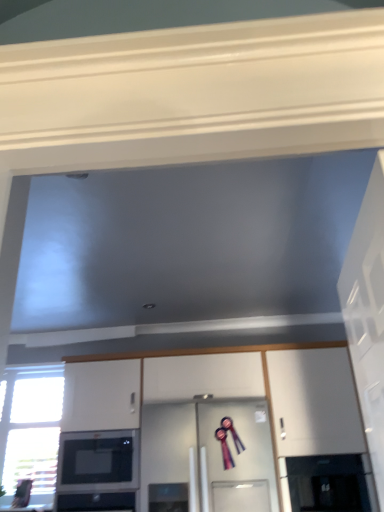
Image resolution: width=384 pixels, height=512 pixels. Describe the element at coordinates (267, 394) in the screenshot. I see `white glossy cabinet at center` at that location.

The height and width of the screenshot is (512, 384). Describe the element at coordinates (99, 459) in the screenshot. I see `black glossy microwave at lower left` at that location.

I want to click on clear glass door at center, arranged as the first glass door when viewed from the left, so click(242, 440).

Is black glossy microwave at lower left taller than transparent glass door at lower right, marked as the first glass door in a right-to-left arrangement?

Indeed, black glossy microwave at lower left has a greater height compared to transparent glass door at lower right, marked as the first glass door in a right-to-left arrangement.

Relative to transparent glass door at lower right, marked as the first glass door in a right-to-left arrangement, is black glossy microwave at lower left in front or behind?

In the image, black glossy microwave at lower left appears behind transparent glass door at lower right, marked as the first glass door in a right-to-left arrangement.

Based on the photo, considering the relative positions of black glossy microwave at lower left and transparent glass door at lower right, which is counted as the second glass door, starting from the left, in the image provided, is black glossy microwave at lower left to the left of transparent glass door at lower right, which is counted as the second glass door, starting from the left, from the viewer's perspective?

Yes.

Between white glossy door at right and transparent glass door at lower right, marked as the first glass door in a right-to-left arrangement, which one appears on the left side from the viewer's perspective?

white glossy door at right.

Between white glossy door at right and transparent glass door at lower right, which is counted as the second glass door, starting from the left, which one has larger width?

With larger width is transparent glass door at lower right, which is counted as the second glass door, starting from the left.

Is point (382, 462) closer or farther from the camera than point (301, 503)?

Point (382, 462) is closer to the camera than point (301, 503).

Does point (129, 432) lie in front of point (369, 375)?

No, it is not.

Are black glossy microwave at lower left and white glossy door at right making contact?

No, black glossy microwave at lower left is not in contact with white glossy door at right.

Is black glossy microwave at lower left not inside white glossy door at right?

Indeed, black glossy microwave at lower left is completely outside white glossy door at right.

Which of these two, black glossy microwave at lower left or white glossy door at right, is bigger?

white glossy door at right is bigger.

Which of these two, white glossy cabinet at center or transparent glass door at lower right, marked as the first glass door in a right-to-left arrangement, is smaller?

With smaller size is transparent glass door at lower right, marked as the first glass door in a right-to-left arrangement.

From a real-world perspective, is white glossy cabinet at center below transparent glass door at lower right, marked as the first glass door in a right-to-left arrangement?

No.

Considering the sizes of white glossy cabinet at center and transparent glass door at lower right, which is counted as the second glass door, starting from the left, in the image, is white glossy cabinet at center wider or thinner than transparent glass door at lower right, which is counted as the second glass door, starting from the left,?

Considering their sizes, white glossy cabinet at center looks broader than transparent glass door at lower right, which is counted as the second glass door, starting from the left.

From a real-world perspective, count 2nd glass doors downward from the black glossy microwave at lower left and point to it. Please provide its 2D coordinates.

[(328, 483)]

Which object is more forward, transparent glass door at lower right, which is counted as the second glass door, starting from the left, or black glossy microwave at lower left?

transparent glass door at lower right, which is counted as the second glass door, starting from the left, is in front.

Consider the image. Can you confirm if transparent glass door at lower right, which is counted as the second glass door, starting from the left, is shorter than black glossy microwave at lower left?

Correct, transparent glass door at lower right, which is counted as the second glass door, starting from the left, is not as tall as black glossy microwave at lower left.

Is transparent glass door at lower right, which is counted as the second glass door, starting from the left, looking in the opposite direction of black glossy microwave at lower left?

No, transparent glass door at lower right, which is counted as the second glass door, starting from the left, is not facing away from black glossy microwave at lower left.

The image size is (384, 512). Identify the location of door that is on the right side of black glossy microwave at lower left. (368, 315).

What's the angular difference between white glossy door at right and black glossy microwave at lower left's facing directions?

The angular difference between white glossy door at right and black glossy microwave at lower left is 97.1 degrees.

Is white glossy door at right in front of or behind black glossy microwave at lower left in the image?

Clearly, white glossy door at right is in front of black glossy microwave at lower left.

Which of these two, white glossy door at right or black glossy microwave at lower left, stands shorter?

With less height is black glossy microwave at lower left.

Which object is wider, clear glass door at center, arranged as the first glass door when viewed from the left, or white glossy cabinet at center?

clear glass door at center, arranged as the first glass door when viewed from the left, is wider.

Consider the image. Is clear glass door at center, arranged as the first glass door when viewed from the left, oriented away from white glossy cabinet at center?

That's right, clear glass door at center, arranged as the first glass door when viewed from the left, is facing away from white glossy cabinet at center.

Does clear glass door at center, which is the 2th glass door from right to left, have a smaller size compared to white glossy cabinet at center?

Indeed, clear glass door at center, which is the 2th glass door from right to left, has a smaller size compared to white glossy cabinet at center.

From a real-world perspective, is clear glass door at center, which is the 2th glass door from right to left, located beneath white glossy cabinet at center?

Indeed, from a real-world perspective, clear glass door at center, which is the 2th glass door from right to left, is positioned beneath white glossy cabinet at center.

Image resolution: width=384 pixels, height=512 pixels. I want to click on the 2nd glass door located beneath the black glossy microwave at lower left (from a real-world perspective), so click(x=328, y=483).

What are the coordinates of `glass door on the right side of white glossy door at right` in the screenshot? It's located at (328, 483).

Estimate the real-world distances between objects in this image. Which object is closer to clear glass window at lower left, white glossy door at right or white glossy cabinet at center?

white glossy cabinet at center lies closer to clear glass window at lower left than the other object.

Considering their positions, is clear glass door at center, arranged as the first glass door when viewed from the left, positioned closer to clear glass window at lower left than white glossy door at right?

clear glass door at center, arranged as the first glass door when viewed from the left.

Based on the photo, based on their spatial positions, is white glossy cabinet at center or black glossy microwave at lower left further from clear glass window at lower left?

The object further to clear glass window at lower left is white glossy cabinet at center.

Which object lies nearer to the anchor point white glossy cabinet at center, clear glass window at lower left or transparent glass door at lower right, which is counted as the second glass door, starting from the left?

transparent glass door at lower right, which is counted as the second glass door, starting from the left, is positioned closer to the anchor white glossy cabinet at center.

From the image, which object appears to be nearer to black glossy microwave at lower left, transparent glass door at lower right, marked as the first glass door in a right-to-left arrangement, or white glossy door at right?

transparent glass door at lower right, marked as the first glass door in a right-to-left arrangement, lies closer to black glossy microwave at lower left than the other object.

When comparing their distances from black glossy microwave at lower left, does white glossy door at right or white glossy cabinet at center seem closer?

white glossy cabinet at center lies closer to black glossy microwave at lower left than the other object.

When comparing their distances from clear glass door at center, arranged as the first glass door when viewed from the left, does black glossy microwave at lower left or clear glass window at lower left seem closer?

The object closer to clear glass door at center, arranged as the first glass door when viewed from the left, is black glossy microwave at lower left.

Looking at the image, which one is located closer to transparent glass door at lower right, which is counted as the second glass door, starting from the left, white glossy cabinet at center or black glossy microwave at lower left?

white glossy cabinet at center is positioned closer to the anchor transparent glass door at lower right, which is counted as the second glass door, starting from the left.

Identify the location of cabinetry between white glossy door at right and clear glass window at lower left along the z-axis. (267, 394).

You are a GUI agent. You are given a task and a screenshot of the screen. Output one action in this format:
    pyautogui.click(x=<x>, y=<y>)
    Task: Click on the cabinetry between white glossy door at right and black glossy microwave at lower left in the front-back direction
    This screenshot has height=512, width=384.
    Given the screenshot: What is the action you would take?
    pyautogui.click(x=267, y=394)

You are a GUI agent. You are given a task and a screenshot of the screen. Output one action in this format:
    pyautogui.click(x=<x>, y=<y>)
    Task: Click on the cabinetry situated between clear glass door at center, which is the 2th glass door from right to left, and transparent glass door at lower right, marked as the first glass door in a right-to-left arrangement, from left to right
    The width and height of the screenshot is (384, 512).
    Given the screenshot: What is the action you would take?
    pyautogui.click(x=267, y=394)

I want to click on microwave oven between white glossy door at right and clear glass window at lower left in the front-back direction, so click(x=99, y=459).